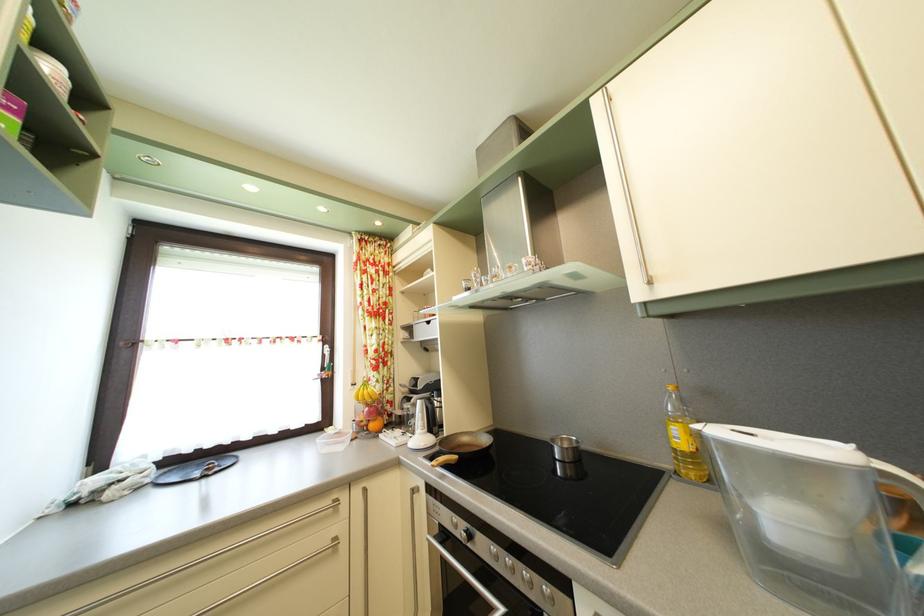
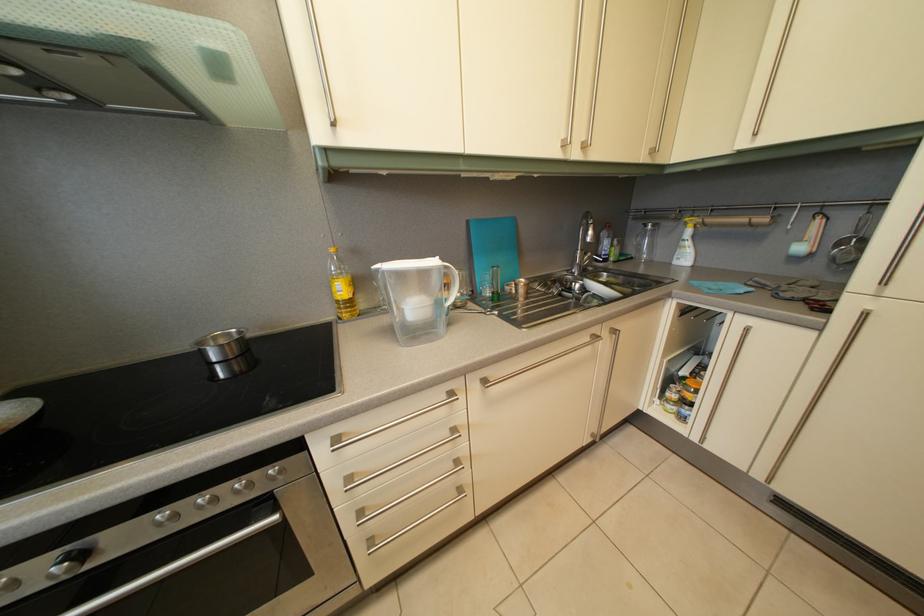
The point at (793,528) is marked in the first image. Where is the corresponding point in the second image?

(421, 315)